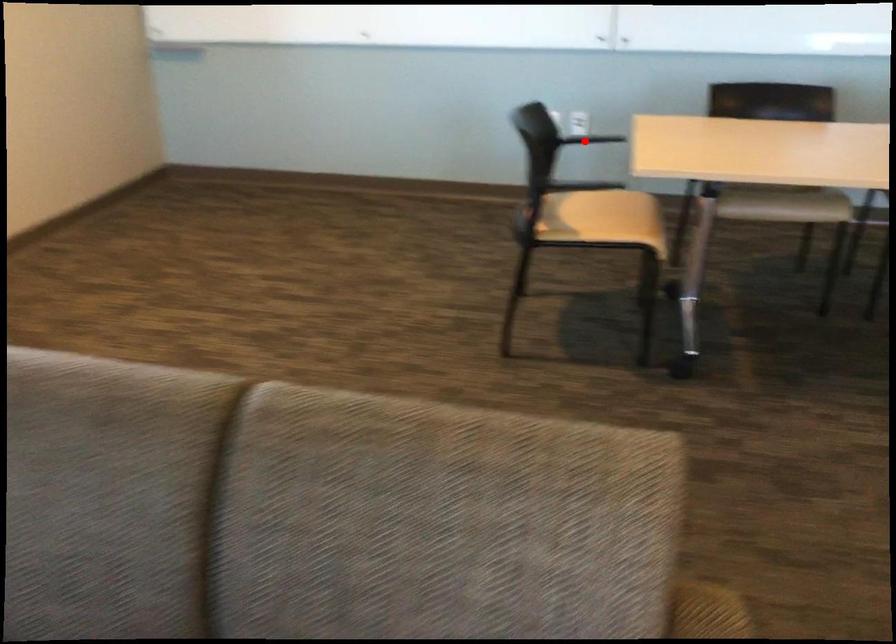
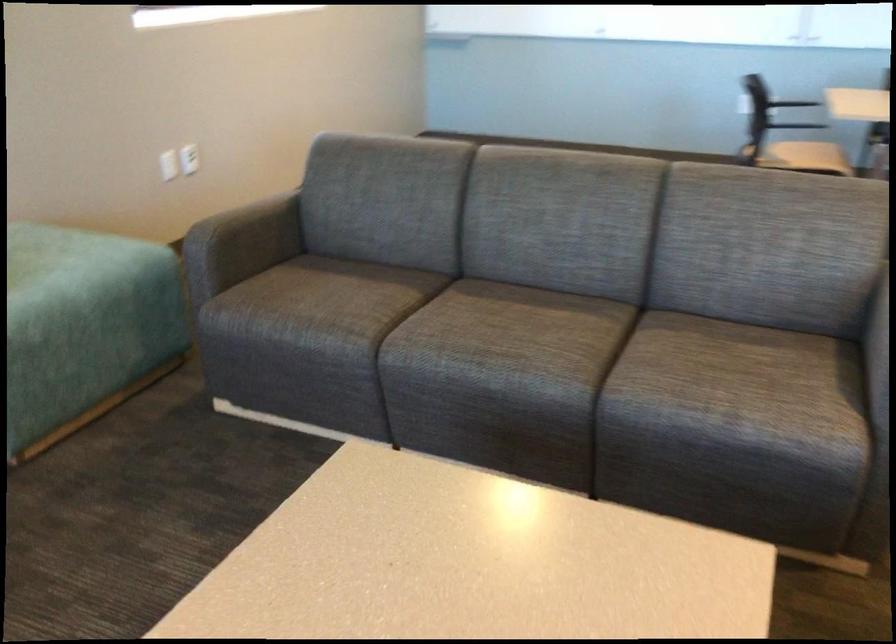
Find the pixel in the second image that matches the highlighted location in the first image.

(788, 102)